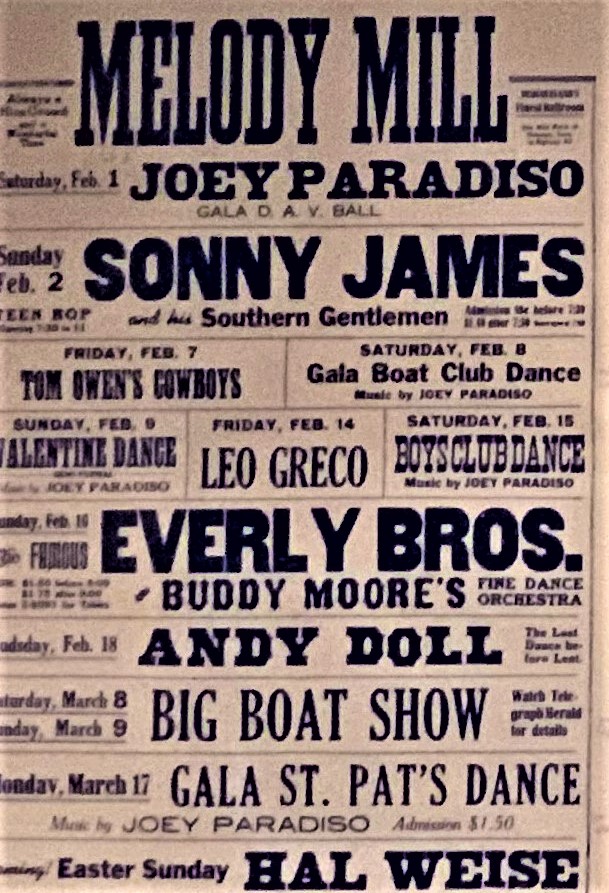
Locate an element on the screen. This screenshot has width=609, height=893. vintage showrunner poster is located at coordinates (527, 35).